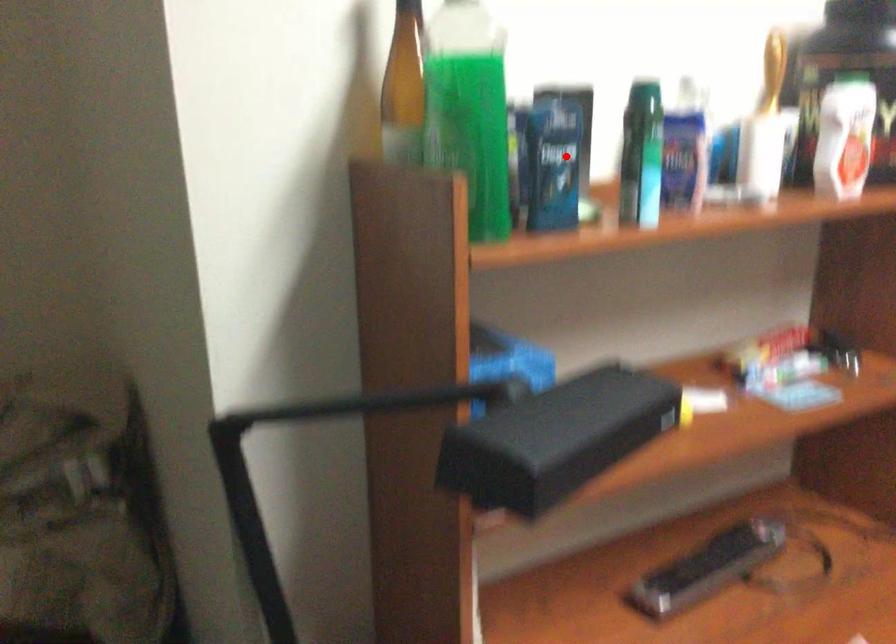
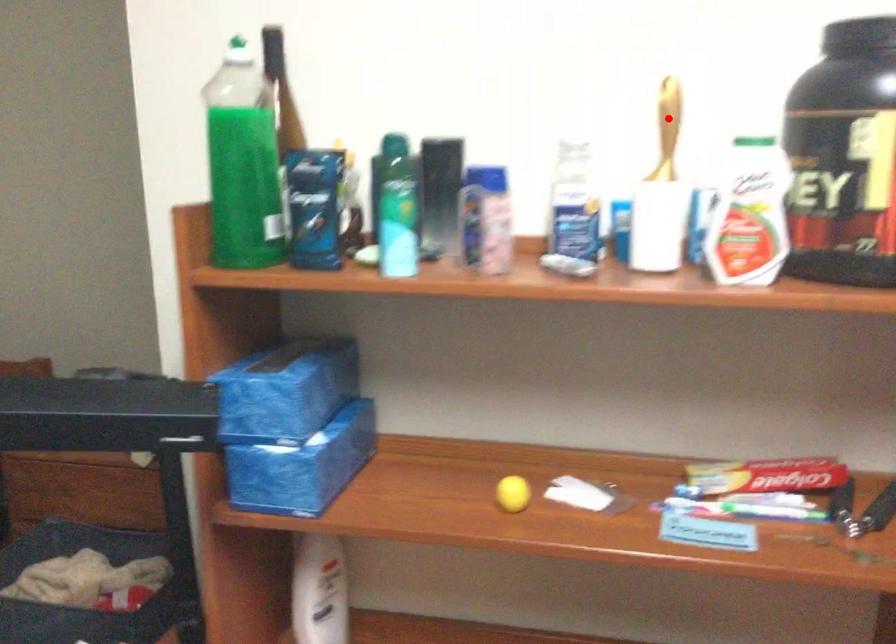
I am providing you with two images of the same scene from different viewpoints. A red point is marked on the first image and another point is marked on the second image. Does the point marked in image1 correspond to the same location as the one in image2?

No